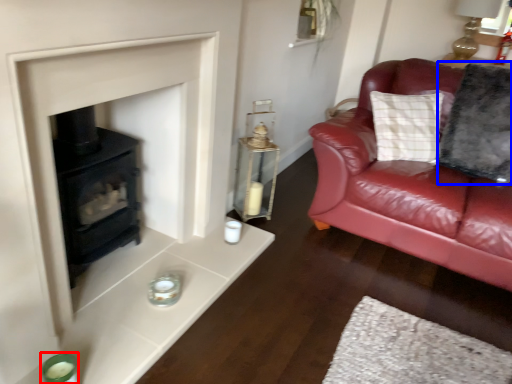
Question: Which of the following is the closest to the observer, candle holder (highlighted by a red box) or pillow (highlighted by a blue box)?

Choices:
 (A) candle holder
 (B) pillow

Answer: (A)